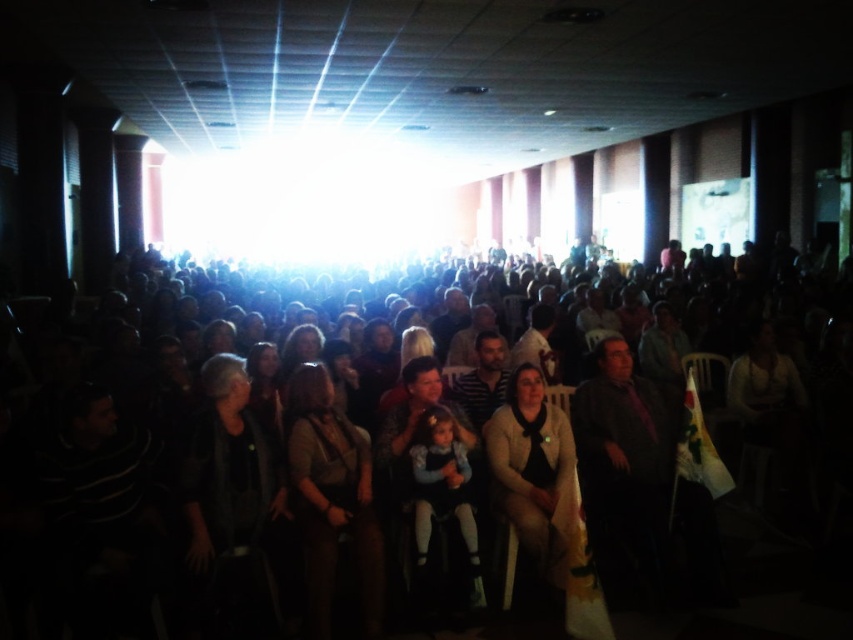
Between dark clothing crowd at center and light beige sweater at center, which one has more height?

With more height is light beige sweater at center.

Is point (291, 337) positioned before point (569, 596)?

That is False.

Image resolution: width=853 pixels, height=640 pixels. What do you see at coordinates (387, 476) in the screenshot? I see `dark clothing crowd at center` at bounding box center [387, 476].

This screenshot has height=640, width=853. In order to click on dark clothing crowd at center in this screenshot , I will do `click(387, 476)`.

Can you confirm if dark clothing crowd at center is positioned above dark gray fabric jacket at center?

Correct, dark clothing crowd at center is located above dark gray fabric jacket at center.

Is point (436, 572) closer to viewer compared to point (323, 556)?

That is False.

You are a GUI agent. You are given a task and a screenshot of the screen. Output one action in this format:
    pyautogui.click(x=<x>, y=<y>)
    Task: Click on the dark clothing crowd at center
    
    Given the screenshot: What is the action you would take?
    pyautogui.click(x=387, y=476)

Is dark clothing crowd at center wider than dark fabric jacket at center?

Yes, dark clothing crowd at center is wider than dark fabric jacket at center.

Where is `dark clothing crowd at center`? dark clothing crowd at center is located at coordinates (387, 476).